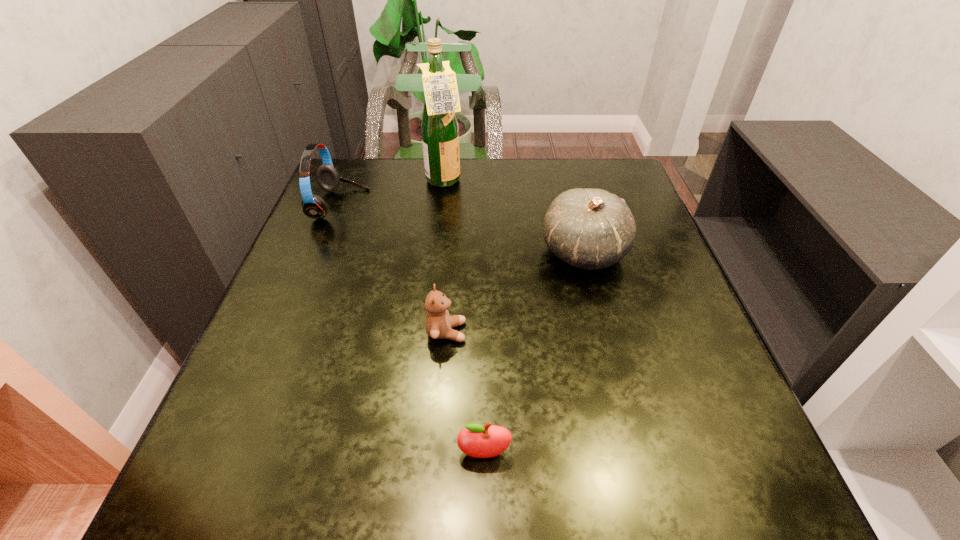
Identify the location of free location that satisfies the following two spatial constraints: 1. on the front-facing side of the shortest object; 2. on the right side of the liquor. (416, 453).

This screenshot has height=540, width=960. Find the location of `free space that satisfies the following two spatial constraints: 1. on the back side of the nearest object; 2. on the front-facing side of the teddy bear`. free space that satisfies the following two spatial constraints: 1. on the back side of the nearest object; 2. on the front-facing side of the teddy bear is located at coordinates (483, 332).